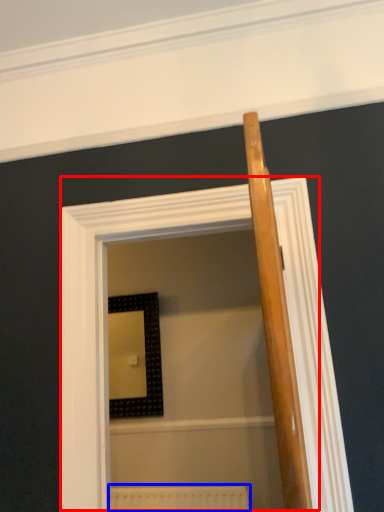
Question: Which of the following is the closest to the observer, screen door (highlighted by a red box) or radiator (highlighted by a blue box)?

Choices:
 (A) screen door
 (B) radiator

Answer: (A)